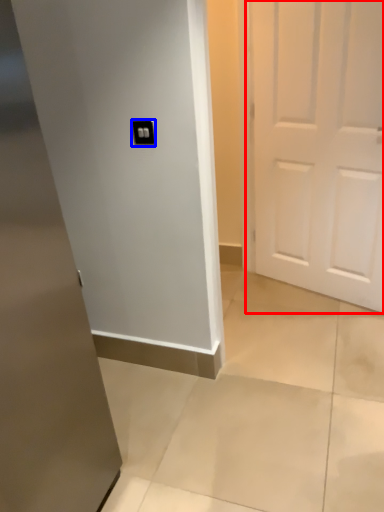
Question: Which point is closer to the camera, door (highlighted by a red box) or light switch (highlighted by a blue box)?

Choices:
 (A) door
 (B) light switch

Answer: (B)